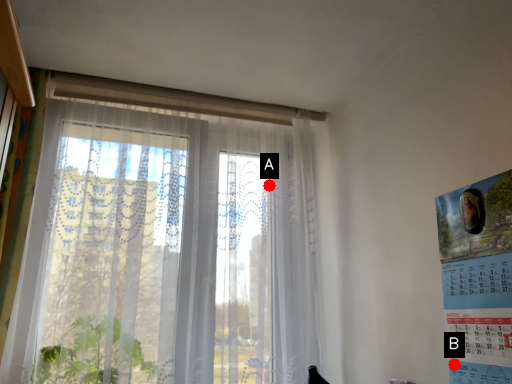
Question: Two points are circled on the image, labeled by A and B beside each circle. Which of the following is the farthest from the observer?

Choices:
 (A) A is further
 (B) B is further

Answer: (A)